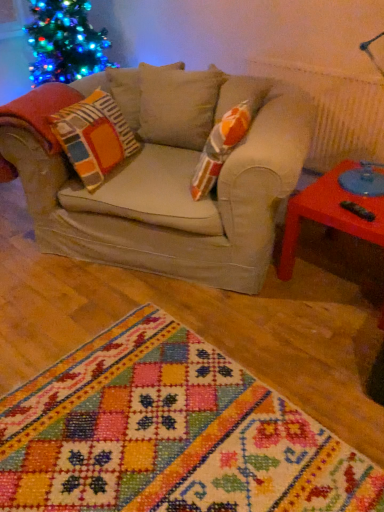
This screenshot has height=512, width=384. Find the location of `vacant region above rubberized plastic table at right (from a real-world perspective)`. vacant region above rubberized plastic table at right (from a real-world perspective) is located at coordinates (343, 198).